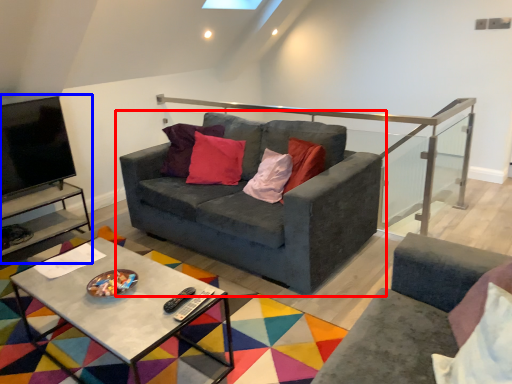
Question: Which object is further to the camera taking this photo, studio couch (highlighted by a red box) or entertainment center (highlighted by a blue box)?

Choices:
 (A) studio couch
 (B) entertainment center

Answer: (B)